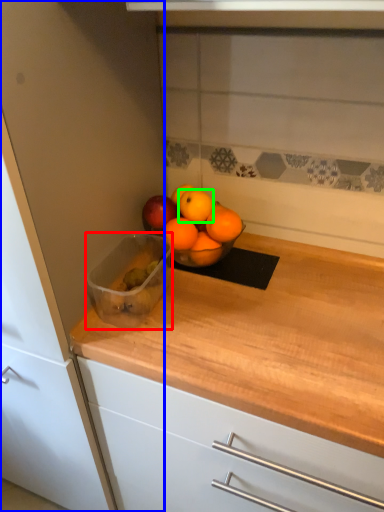
Question: Considering the real-world distances, which object is closest to glass bowl (highlighted by a red box)? cabinetry (highlighted by a blue box) or orange (highlighted by a green box).

Choices:
 (A) cabinetry
 (B) orange

Answer: (B)